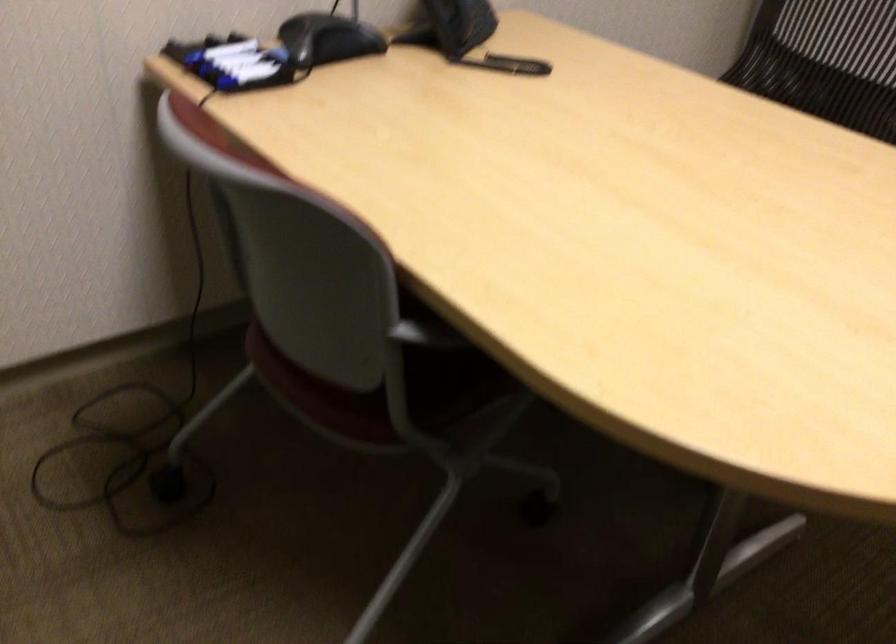
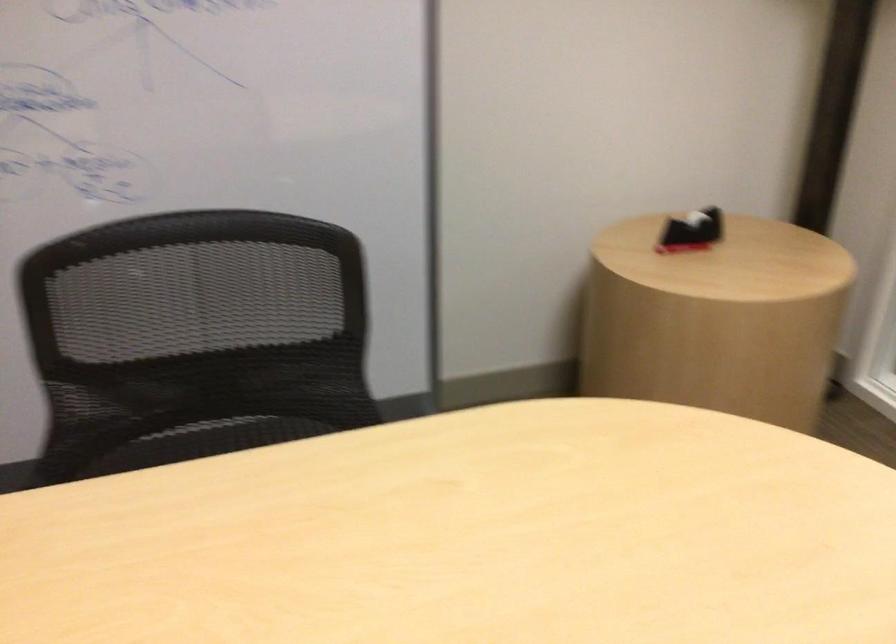
Question: The images are taken continuously from a first-person perspective. In which direction is your viewpoint rotating?

Choices:
 (A) Left
 (B) Right
 (C) Up
 (D) Down

Answer: (B)